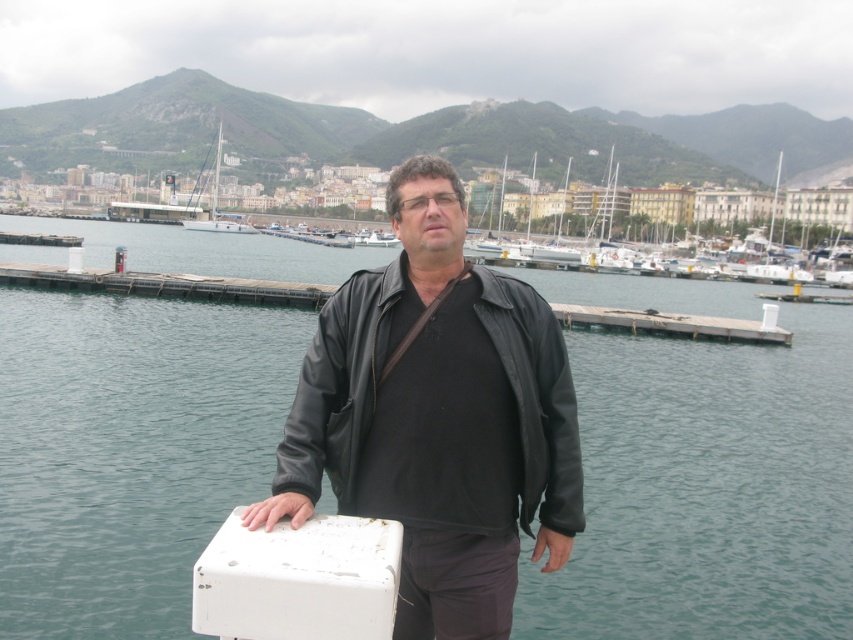
Does white glossy boat at center appear over white glossy sailboat at upper left?

No, white glossy boat at center is not above white glossy sailboat at upper left.

Is white glossy boat at center positioned behind white glossy sailboat at upper left?

No.

Is point (772, 218) behind point (227, 228)?

No, (772, 218) is in front of (227, 228).

You are a GUI agent. You are given a task and a screenshot of the screen. Output one action in this format:
    pyautogui.click(x=<x>, y=<y>)
    Task: Click on the white glossy boat at center
    Image resolution: width=853 pixels, height=640 pixels.
    Given the screenshot: What is the action you would take?
    pyautogui.click(x=759, y=216)

Between wooden dock at center and white glossy sailboat at upper left, which one appears on the right side from the viewer's perspective?

From the viewer's perspective, wooden dock at center appears more on the right side.

Does wooden dock at center appear on the left side of white glossy sailboat at upper left?

No, wooden dock at center is not to the left of white glossy sailboat at upper left.

Is point (775, 340) farther from viewer compared to point (184, 224)?

No, it is in front of (184, 224).

I want to click on wooden dock at center, so click(x=167, y=285).

Does transparent water at center have a smaller size compared to wooden dock at center?

No.

Is transparent water at center to the left of wooden dock at center from the viewer's perspective?

Yes, transparent water at center is to the left of wooden dock at center.

Image resolution: width=853 pixels, height=640 pixels. Find the location of `transparent water at center`. transparent water at center is located at coordinates (706, 488).

You are a GUI agent. You are given a task and a screenshot of the screen. Output one action in this format:
    pyautogui.click(x=<x>, y=<y>)
    Task: Click on the transparent water at center
    
    Given the screenshot: What is the action you would take?
    pyautogui.click(x=706, y=488)